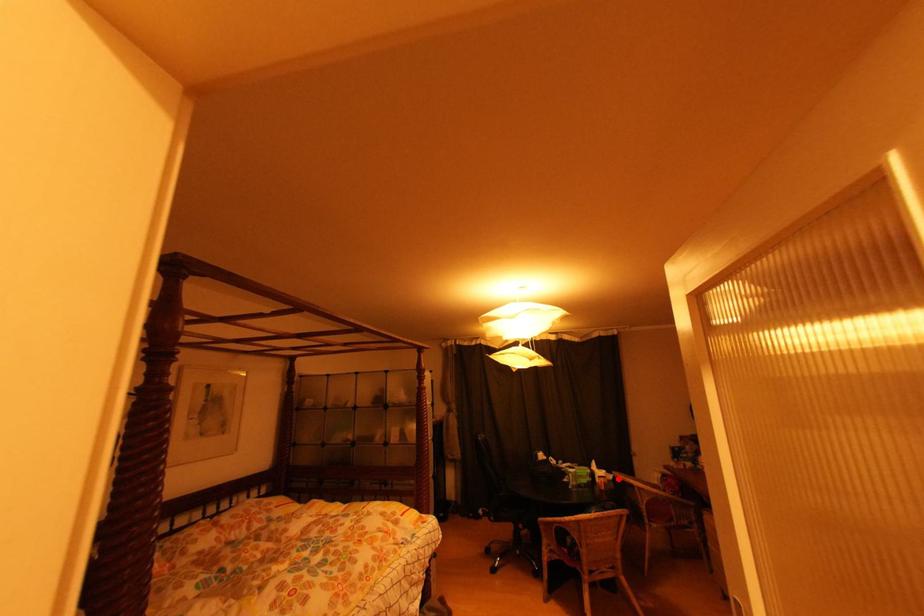
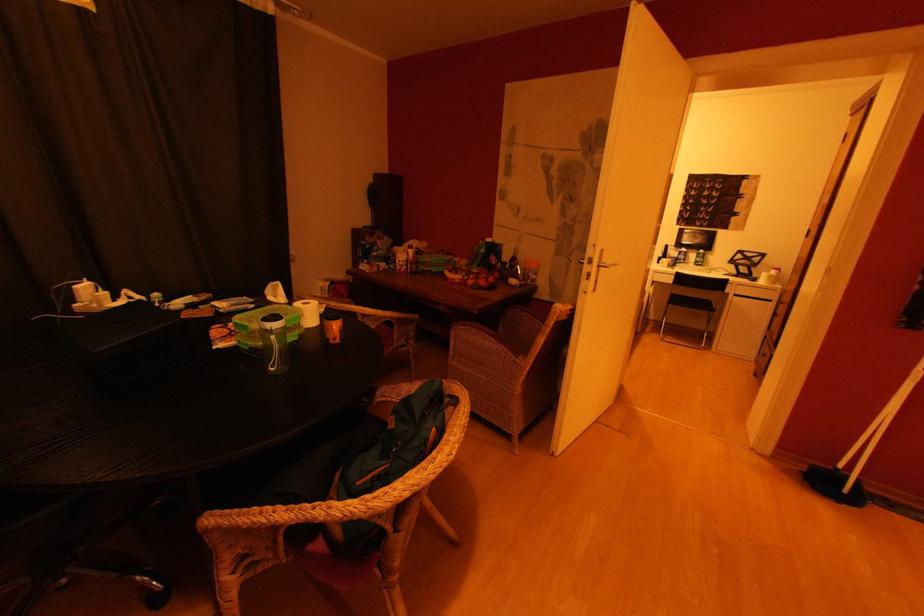
The point at the highlighted location is marked in the first image. Where is the corresponding point in the second image?

(331, 310)